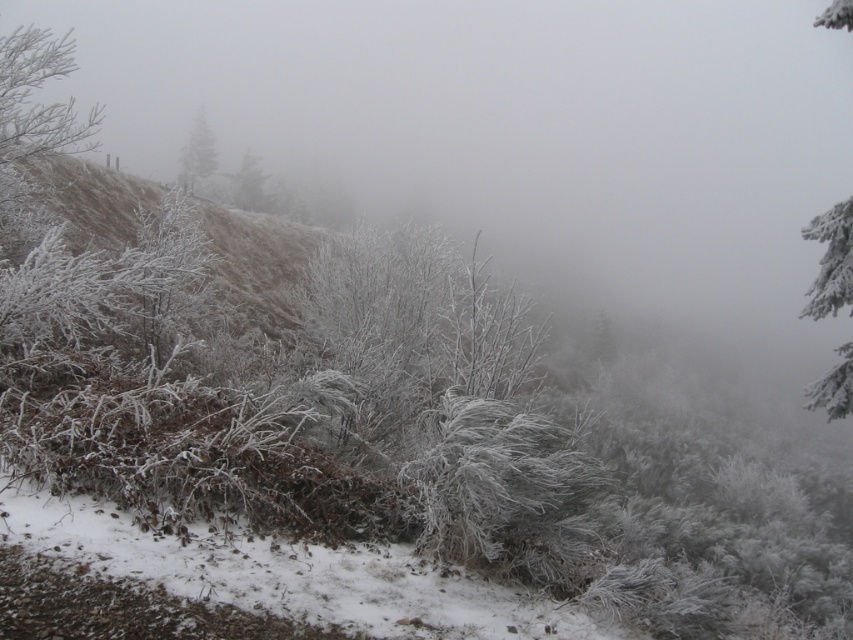
Is white frosty tree at right above frosted evergreen tree at center?

Incorrect, white frosty tree at right is not positioned above frosted evergreen tree at center.

Locate an element on the screen. white frosty tree at right is located at coordinates (831, 260).

Find the location of a particular element. The width and height of the screenshot is (853, 640). white frosty tree at right is located at coordinates (831, 260).

From the picture: Is white frosty tree at right wider than snow-covered evergreen tree at upper center?

Correct, the width of white frosty tree at right exceeds that of snow-covered evergreen tree at upper center.

Does white frosty tree at right appear under snow-covered evergreen tree at upper center?

Yes, white frosty tree at right is below snow-covered evergreen tree at upper center.

Is point (833, 292) farther from viewer compared to point (196, 109)?

No, it is in front of (196, 109).

Where is `white frosty tree at right`? white frosty tree at right is located at coordinates (831, 260).

Is point (202, 131) positioned before point (238, 177)?

No.

Does snow-covered evergreen tree at upper center have a lesser height compared to frosted evergreen tree at center?

In fact, snow-covered evergreen tree at upper center may be taller than frosted evergreen tree at center.

Is point (195, 179) closer to viewer compared to point (247, 182)?

No, (195, 179) is behind (247, 182).

Locate an element on the screen. This screenshot has height=640, width=853. snow-covered evergreen tree at upper center is located at coordinates (196, 154).